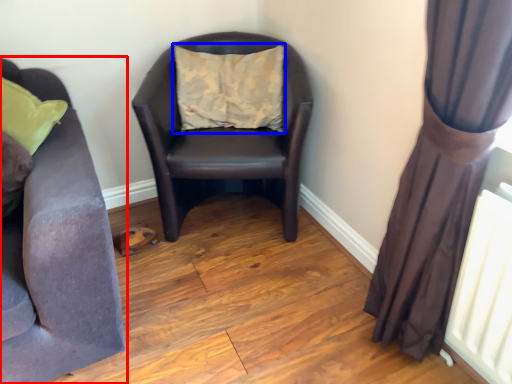
Question: Which of the following is the farthest to the observer, studio couch (highlighted by a red box) or pillow (highlighted by a blue box)?

Choices:
 (A) studio couch
 (B) pillow

Answer: (B)